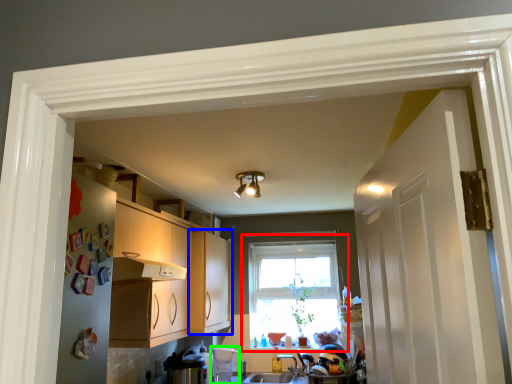
Question: Considering the real-world distances, which object is closest to window (highlighted by a red box)? cabinetry (highlighted by a blue box) or appliance (highlighted by a green box).

Choices:
 (A) cabinetry
 (B) appliance

Answer: (A)